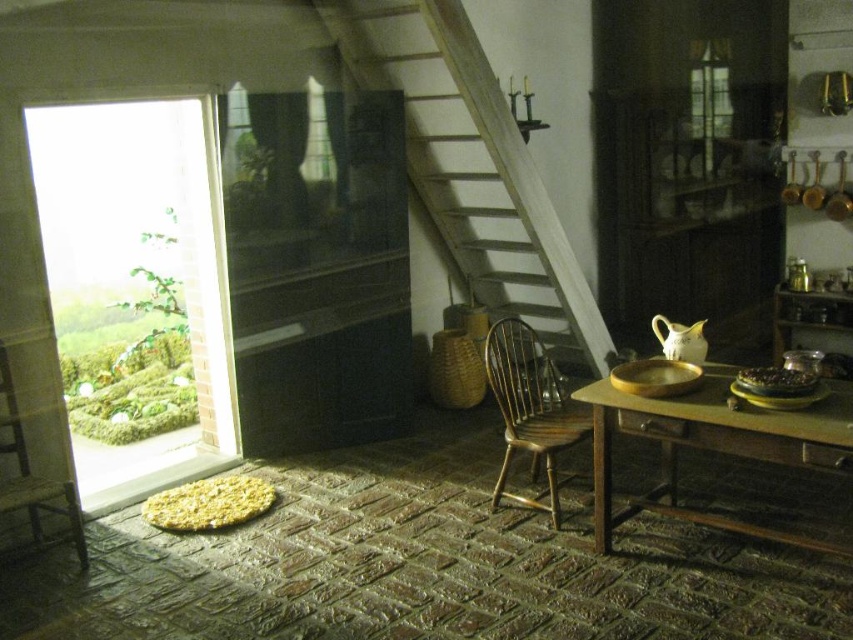
Consider the image. Does wooden table at lower right appear under wooden chair at center?

Yes.

Which is more to the left, wooden table at lower right or wooden chair at center?

wooden chair at center is more to the left.

Between point (685, 403) and point (514, 369), which one is positioned in front?

Point (685, 403)

This screenshot has width=853, height=640. Find the location of `wooden table at lower right`. wooden table at lower right is located at coordinates (717, 445).

Who is positioned more to the left, wooden table at lower right or wooden chair at left?

Positioned to the left is wooden chair at left.

What are the coordinates of `wooden table at lower right` in the screenshot? It's located at (717, 445).

Is point (683, 422) behind point (9, 378)?

That is False.

You are a GUI agent. You are given a task and a screenshot of the screen. Output one action in this format:
    pyautogui.click(x=<x>, y=<y>)
    Task: Click on the wooden table at lower right
    The height and width of the screenshot is (640, 853).
    Given the screenshot: What is the action you would take?
    pyautogui.click(x=717, y=445)

Is wooden stairs at center behind wooden table at lower right?

Yes, it is behind wooden table at lower right.

Who is more forward, (485, 86) or (599, 474)?

Point (599, 474) is in front.

What do you see at coordinates (473, 164) in the screenshot? I see `wooden stairs at center` at bounding box center [473, 164].

This screenshot has height=640, width=853. I want to click on wooden stairs at center, so click(x=473, y=164).